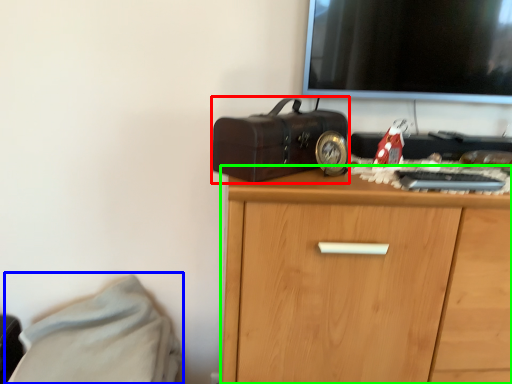
Question: Estimate the real-world distances between objects in this image. Which object is closer to suitcase (highlighted by a red box), bed (highlighted by a blue box) or chest of drawers (highlighted by a green box)?

Choices:
 (A) bed
 (B) chest of drawers

Answer: (B)